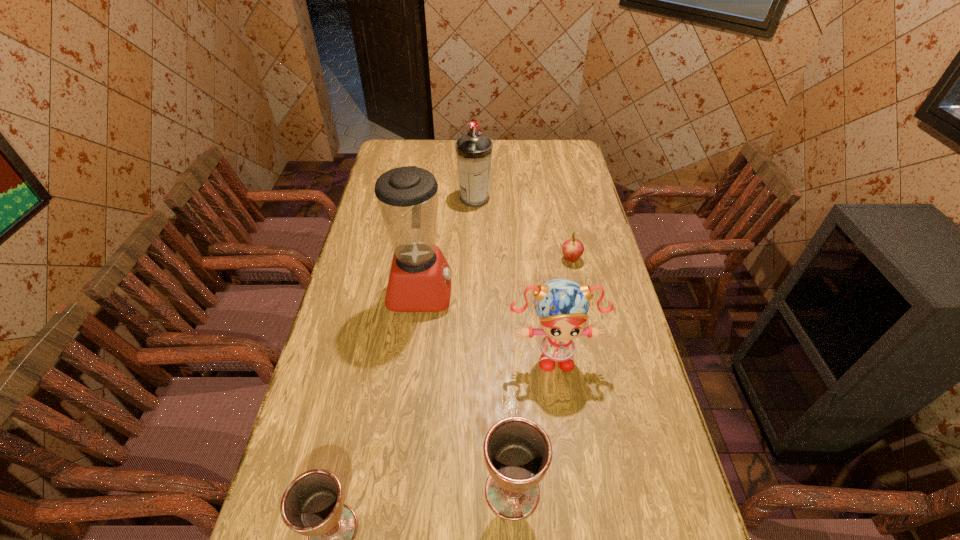
Find the location of a particular element. The width and height of the screenshot is (960, 540). the taller chalice is located at coordinates (518, 452).

This screenshot has width=960, height=540. Find the location of `the right chalice`. the right chalice is located at coordinates (518, 452).

The image size is (960, 540). I want to click on the tallest object, so click(x=420, y=277).

Find the location of `the farthest object`. the farthest object is located at coordinates (474, 150).

This screenshot has height=540, width=960. I want to click on the second tallest object, so coord(474,150).

This screenshot has width=960, height=540. I want to click on the shortest object, so click(572, 249).

Identify the location of the fourth shortest object. This screenshot has width=960, height=540. (562, 304).

Locate an element on the screen. doll is located at coordinates (562, 304).

Where is `vacant space located 0.120m on the right of the third shortest object`? vacant space located 0.120m on the right of the third shortest object is located at coordinates (593, 491).

Locate an element on the screen. The image size is (960, 540). free space located 0.200m on the front of the tallest object near the controls is located at coordinates (513, 291).